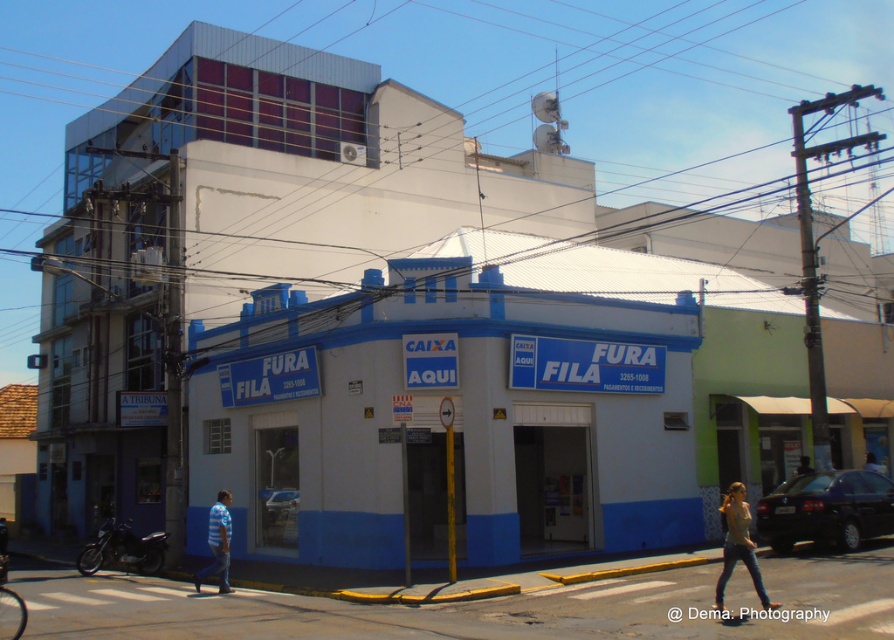
Can you confirm if matte gray tank top at center is smaller than striped shirt at lower left?

Correct, matte gray tank top at center occupies less space than striped shirt at lower left.

Is point (748, 540) positioned behind point (209, 538)?

No, (748, 540) is closer to viewer.

This screenshot has width=894, height=640. I want to click on matte gray tank top at center, so click(738, 545).